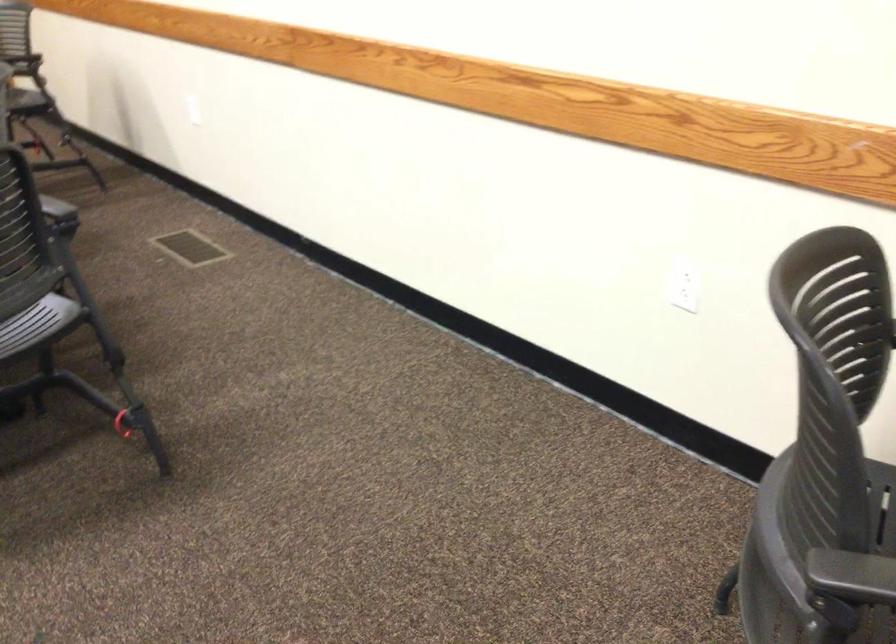
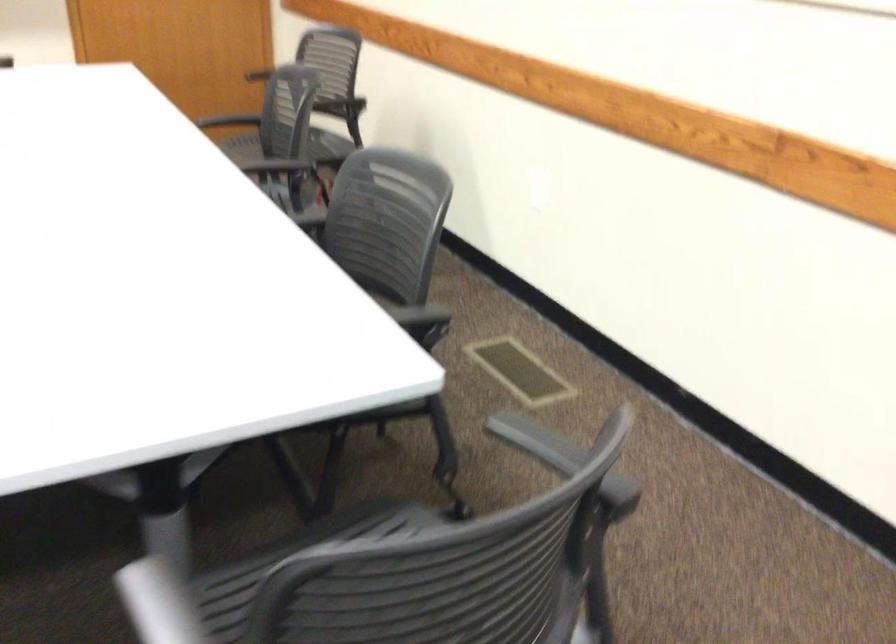
The point at (183, 242) is marked in the first image. Where is the corresponding point in the second image?

(520, 370)